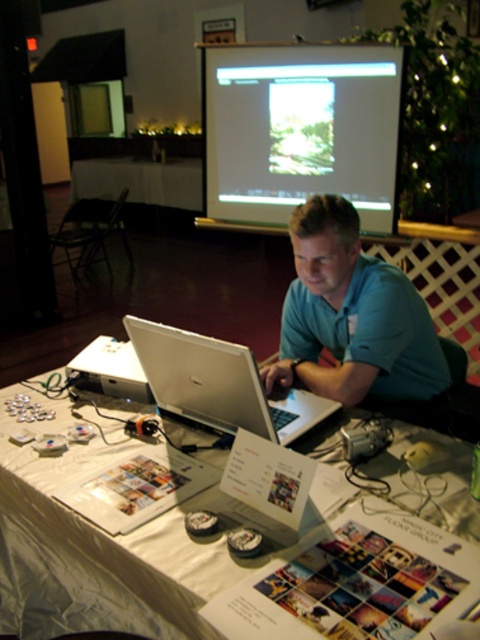
Between point (327, 337) and point (145, 356), which one is positioned behind?

The point (327, 337) is more distant.

Does blue smooth shirt at center come behind silver metallic laptop at center?

Yes.

Does point (304, 212) lie in front of point (149, 353)?

No.

The height and width of the screenshot is (640, 480). What are the coordinates of `blue smooth shirt at center` in the screenshot? It's located at (351, 316).

Is point (64, 588) behind point (338, 397)?

No.

Image resolution: width=480 pixels, height=640 pixels. Identify the location of white plastic table at center. (97, 547).

Who is more forward, (95, 554) or (380, 376)?

Point (95, 554) is more forward.

Find the location of a particular element. This screenshot has width=480, height=640. white plastic table at center is located at coordinates (97, 547).

Is white plastic table at center thinner than silver metallic laptop at center?

In fact, white plastic table at center might be wider than silver metallic laptop at center.

Is white plastic table at center bigger than silver metallic laptop at center?

Indeed, white plastic table at center has a larger size compared to silver metallic laptop at center.

Identify the location of white plastic table at center. This screenshot has width=480, height=640. (97, 547).

Identify the location of white plastic table at center. The width and height of the screenshot is (480, 640). (97, 547).